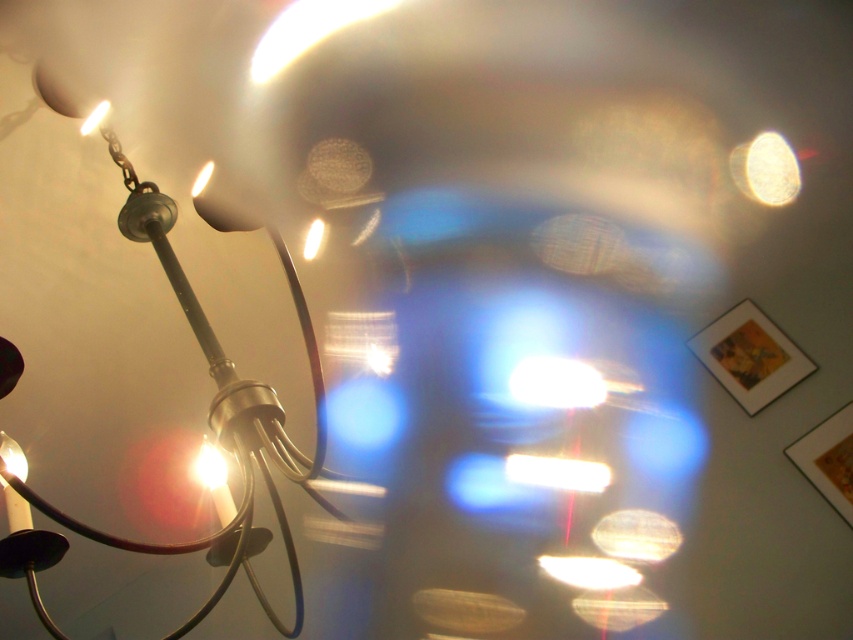
You are an interior designer assessing the lighting in a room with the chandelier described. You need to determine which bulb is taller between the white glossy light bulb at center and the matte white bulb at upper left. Which one is taller?

The white glossy light bulb at center is much taller than the matte white bulb at upper left according to the description.